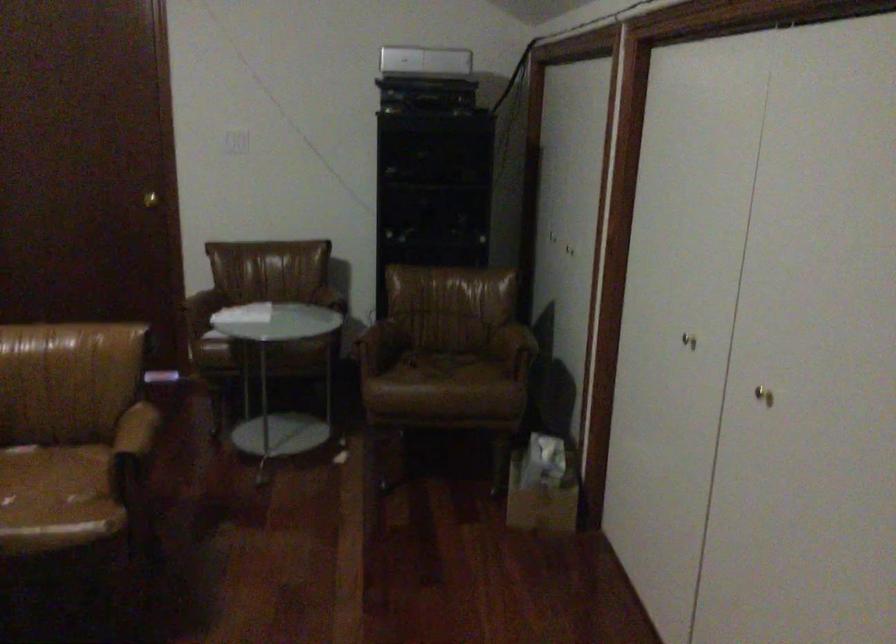
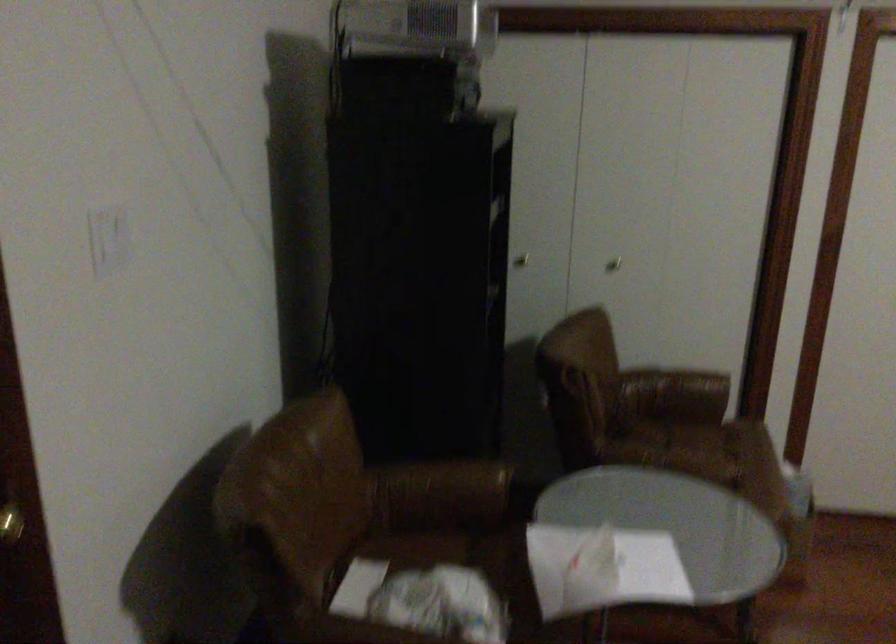
Find the pixel in the second image that matches pixel 570 251 in the first image.

(613, 263)